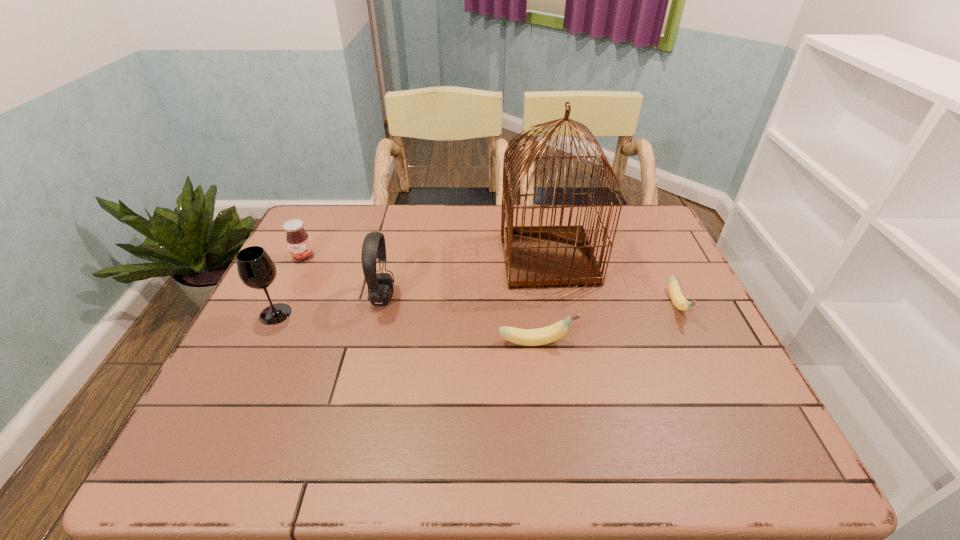
This screenshot has height=540, width=960. Identify the location of the nearer banana. (527, 337).

The height and width of the screenshot is (540, 960). I want to click on the nearest object, so click(527, 337).

The height and width of the screenshot is (540, 960). I want to click on the shortest object, so click(x=679, y=301).

Image resolution: width=960 pixels, height=540 pixels. I want to click on the farther banana, so click(x=679, y=301).

Image resolution: width=960 pixels, height=540 pixels. In order to click on the fourth tallest object in this screenshot , I will do `click(298, 241)`.

Find the location of a particular element. The height and width of the screenshot is (540, 960). birdcage is located at coordinates (539, 256).

Find the location of a particular element. This screenshot has height=540, width=960. the fourth object from right to left is located at coordinates (380, 285).

Locate an element on the screen. The image size is (960, 540). wineglass is located at coordinates (256, 269).

This screenshot has height=540, width=960. Find the location of `free spot located 0.120m at the stem of the nearer banana`. free spot located 0.120m at the stem of the nearer banana is located at coordinates (627, 342).

Where is `vacant position located at the stem of the shorter banana`? vacant position located at the stem of the shorter banana is located at coordinates (728, 408).